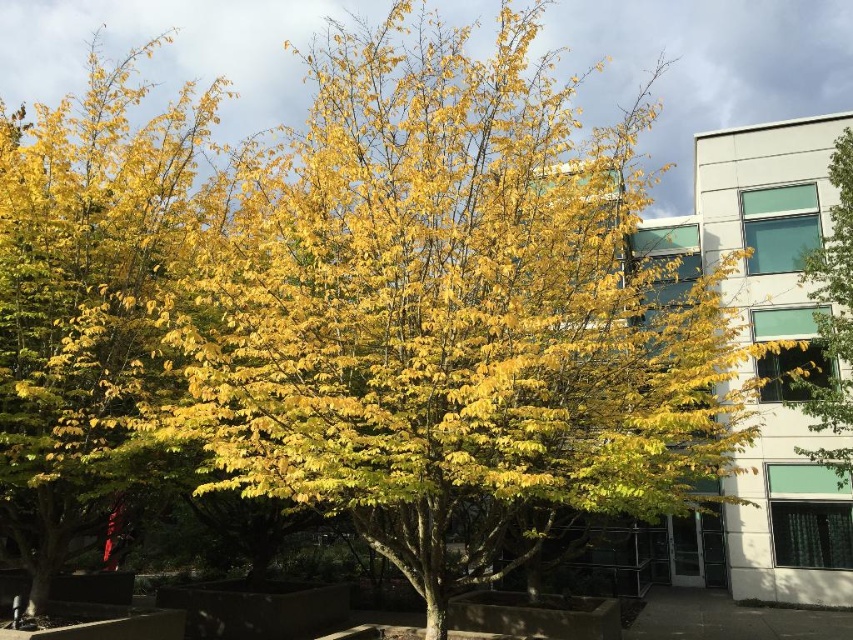
Question: Which point appears closest to the camera in this image?

Choices:
 (A) (846, 433)
 (B) (28, 225)

Answer: (B)

Question: Is yellow-green leaves at left below yellow leafy tree at center?

Choices:
 (A) yes
 (B) no

Answer: (B)

Question: Is yellow-green leaves at left thinner than yellow leafy tree at center?

Choices:
 (A) no
 (B) yes

Answer: (A)

Question: Is yellow-green leaves at left smaller than yellow leafy tree at center?

Choices:
 (A) no
 (B) yes

Answer: (A)

Question: Among these points, which one is farthest from the camera?

Choices:
 (A) (79, 179)
 (B) (822, 260)

Answer: (B)